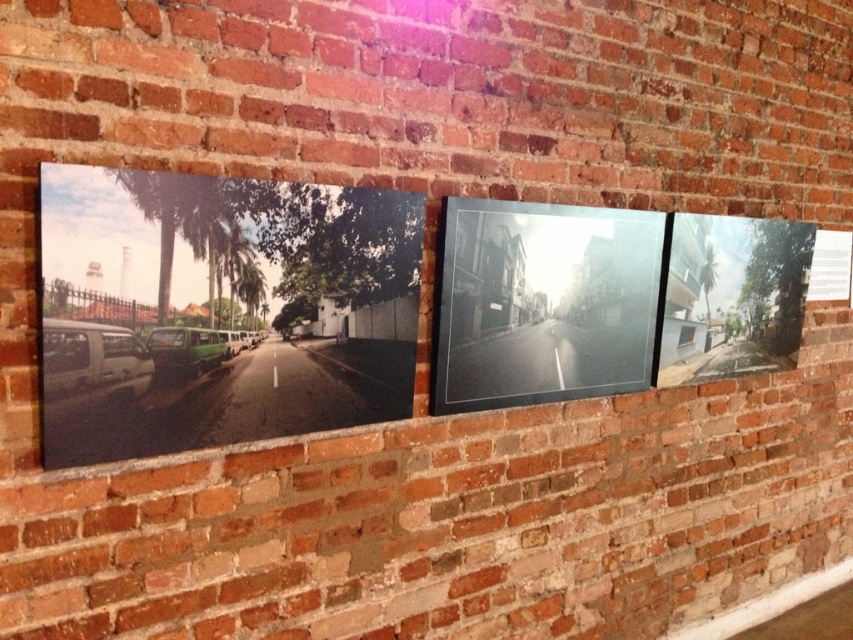
Who is higher up, matte canvas print at left or transparent glass picture frame at center?

transparent glass picture frame at center

Between matte canvas print at left and transparent glass picture frame at center, which one appears on the left side from the viewer's perspective?

From the viewer's perspective, matte canvas print at left appears more on the left side.

Which is in front, point (201, 272) or point (625, 340)?

Point (201, 272)

I want to click on matte canvas print at left, so click(x=219, y=308).